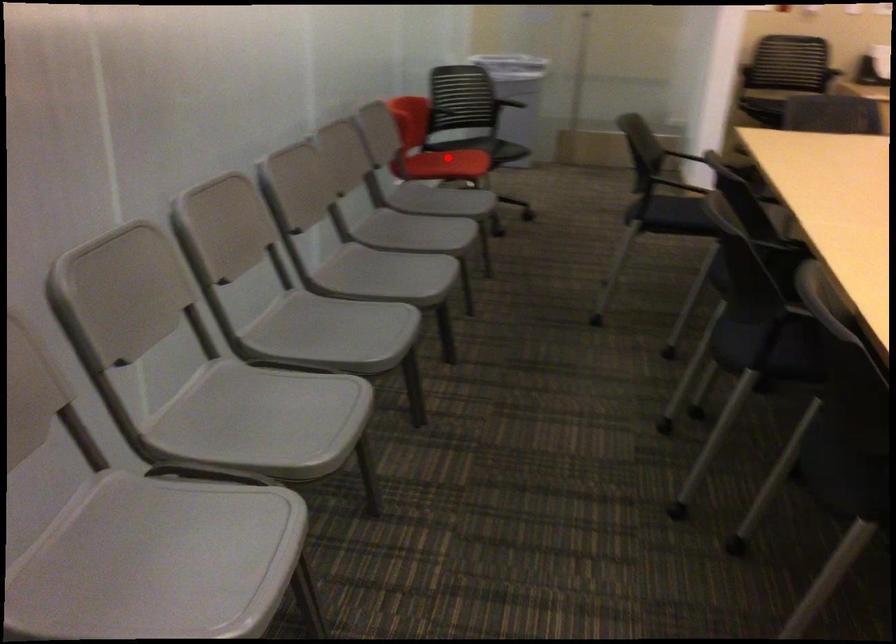
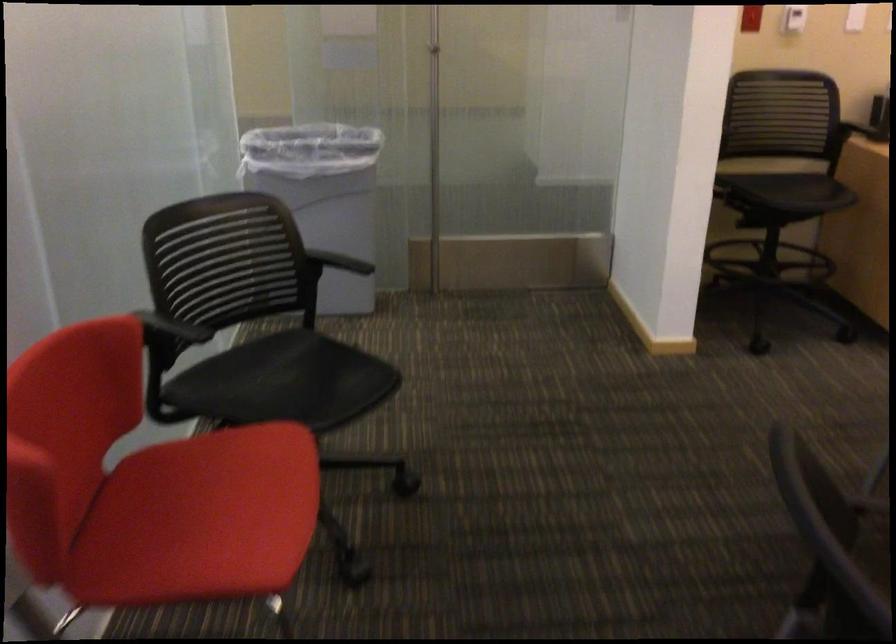
Locate, in the second image, the point that corresponds to the highlighted location in the first image.

(200, 518)